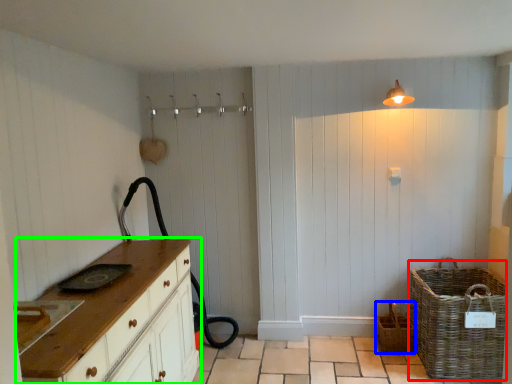
Question: Estimate the real-world distances between objects in this image. Which object is farther from basket (highlighted by a red box), basket (highlighted by a blue box) or chest of drawers (highlighted by a green box)?

Choices:
 (A) basket
 (B) chest of drawers

Answer: (B)